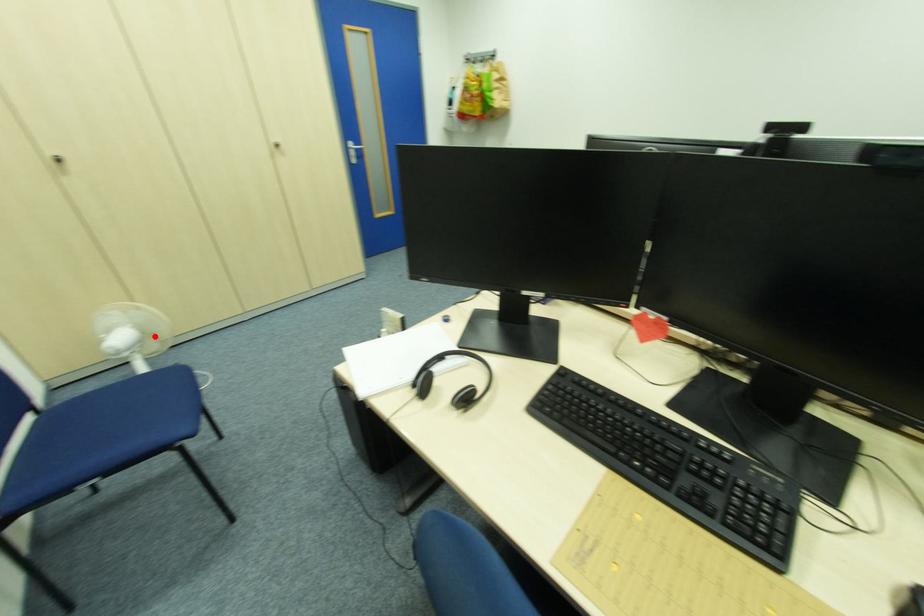
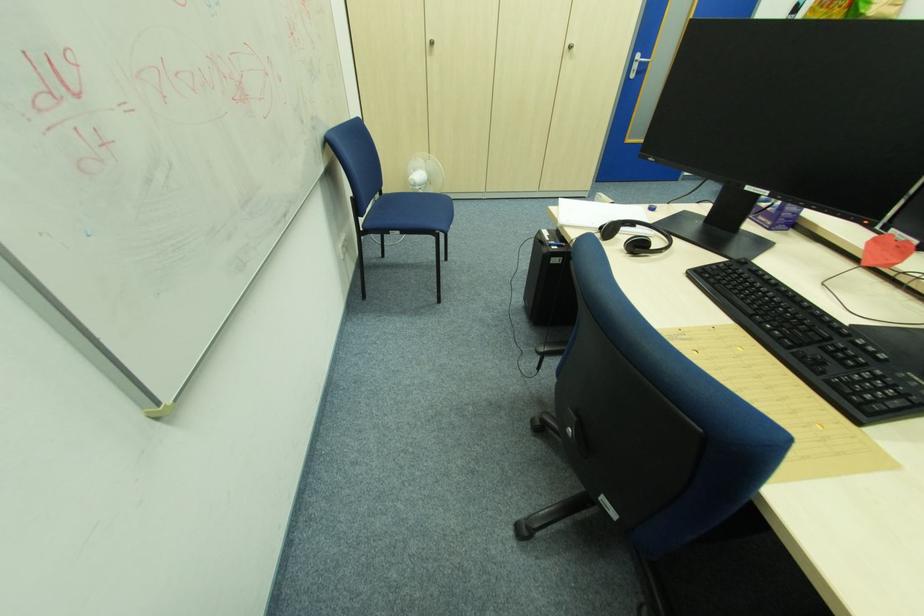
Locate, in the second image, the point that corresponds to the highlighted location in the first image.

(434, 183)